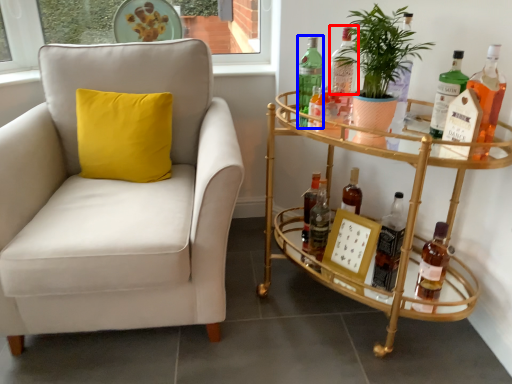
Question: Among these objects, which one is farthest to the camera, bottle (highlighted by a red box) or bottle (highlighted by a blue box)?

Choices:
 (A) bottle
 (B) bottle

Answer: (B)